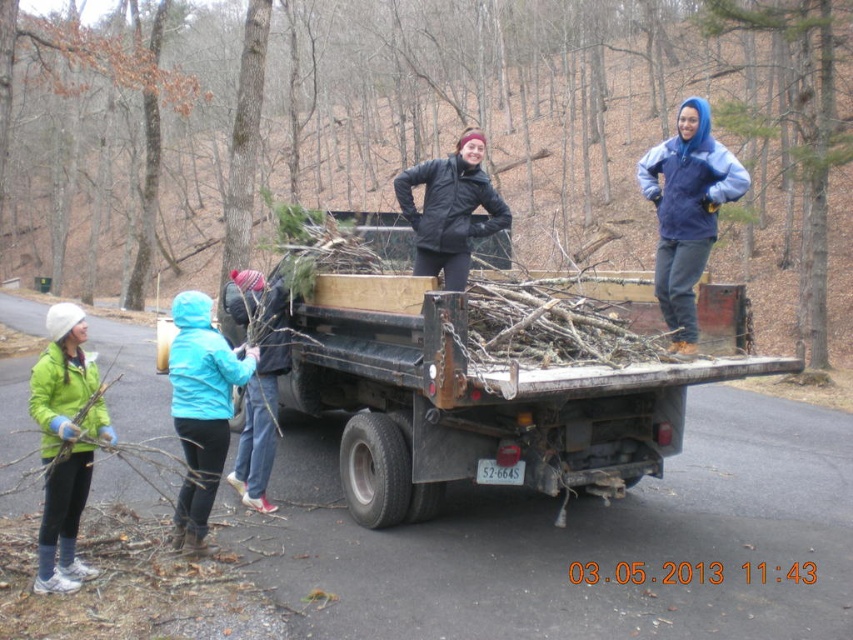
Question: Among these objects, which one is farthest from the camera?

Choices:
 (A) blue fleece jacket at center
 (B) brown rough wood at center
 (C) blue fleece jacket at upper right

Answer: (B)

Question: Does brown rough wood at center appear over green matte jacket at left?

Choices:
 (A) no
 (B) yes

Answer: (B)

Question: Is rusty metal truck at center wider than black matte jacket at center?

Choices:
 (A) no
 (B) yes

Answer: (B)

Question: Among these objects, which one is nearest to the camera?

Choices:
 (A) rusty metal truck at center
 (B) blue fleece jacket at lower left

Answer: (A)

Question: Does brown rough wood at center appear under rusty metal truck at center?

Choices:
 (A) yes
 (B) no

Answer: (B)

Question: Which point is farther from the camera taking this photo?

Choices:
 (A) (642, 476)
 (B) (445, 177)
 (C) (73, 372)
 (D) (236, 460)

Answer: (A)